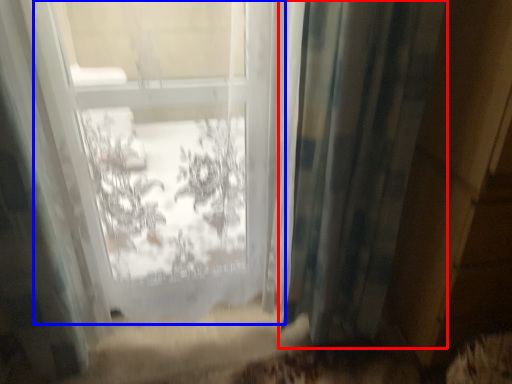
Question: Which object appears closest to the camera in this image, curtain (highlighted by a red box) or bay window (highlighted by a blue box)?

Choices:
 (A) curtain
 (B) bay window

Answer: (B)